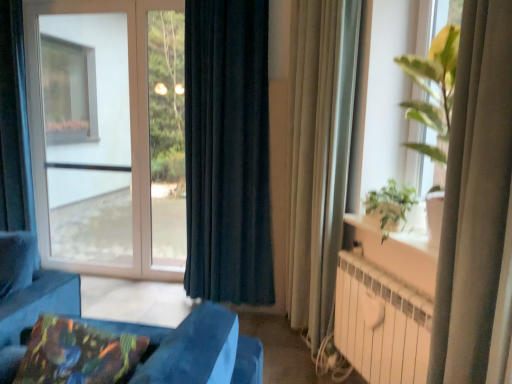
Question: Should I look upward or downward to see multicolored fabric pillow at lower left?

Choices:
 (A) up
 (B) down

Answer: (B)

Question: Is beige fabric curtain at right, the 2th curtain when ordered from back to front, positioned before white metallic radiator at lower right?

Choices:
 (A) yes
 (B) no

Answer: (B)

Question: Can you confirm if beige fabric curtain at right, the 2th curtain when ordered from back to front, is positioned to the right of white metallic radiator at lower right?

Choices:
 (A) no
 (B) yes

Answer: (A)

Question: Is beige fabric curtain at right, the second curtain when ordered from left to right, aimed at white metallic radiator at lower right?

Choices:
 (A) yes
 (B) no

Answer: (B)

Question: Considering the relative sizes of beige fabric curtain at right, which appears as the 2th curtain when viewed from the front, and white metallic radiator at lower right in the image provided, is beige fabric curtain at right, which appears as the 2th curtain when viewed from the front, wider than white metallic radiator at lower right?

Choices:
 (A) no
 (B) yes

Answer: (B)

Question: From a real-world perspective, is beige fabric curtain at right, which appears as the 2th curtain when viewed from the front, positioned over white metallic radiator at lower right based on gravity?

Choices:
 (A) no
 (B) yes

Answer: (B)

Question: Considering the relative sizes of beige fabric curtain at right, the second curtain when ordered from left to right, and white metallic radiator at lower right in the image provided, is beige fabric curtain at right, the second curtain when ordered from left to right, bigger than white metallic radiator at lower right?

Choices:
 (A) yes
 (B) no

Answer: (A)

Question: From the image's perspective, is green leafy plant at right located beneath beige sheer curtain at right, the first curtain from the front?

Choices:
 (A) no
 (B) yes

Answer: (A)

Question: Is green leafy plant at right outside beige sheer curtain at right, the third curtain in the left-to-right sequence?

Choices:
 (A) no
 (B) yes

Answer: (B)

Question: Is green leafy plant at right taller than beige sheer curtain at right, arranged as the first curtain when viewed from the right?

Choices:
 (A) yes
 (B) no

Answer: (B)

Question: Is green leafy plant at right far from beige sheer curtain at right, arranged as the first curtain when viewed from the right?

Choices:
 (A) no
 (B) yes

Answer: (A)

Question: Considering the relative positions of green leafy plant at right and beige sheer curtain at right, the third curtain from the back, in the image provided, is green leafy plant at right behind beige sheer curtain at right, the third curtain from the back,?

Choices:
 (A) yes
 (B) no

Answer: (A)

Question: Does green leafy plant at right have a smaller size compared to beige sheer curtain at right, the third curtain in the left-to-right sequence?

Choices:
 (A) yes
 (B) no

Answer: (A)

Question: From a real-world perspective, is beige fabric curtain at right, the second curtain when ordered from left to right, beneath beige sheer curtain at right, the first curtain from the front?

Choices:
 (A) no
 (B) yes

Answer: (A)